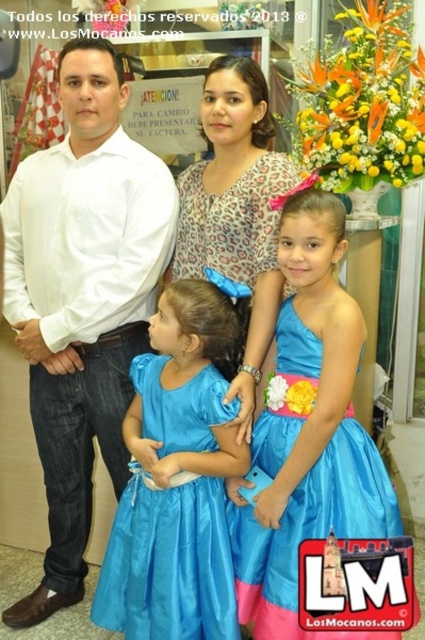
You are a photographer trying to adjust the spacing between the two girls wearing the matte blue dress at center and the blue satin dress at center so that they are exactly 10 inches apart. Currently, how far apart are they?

The matte blue dress at center is 9.13 inches from blue satin dress at center.

Based on the photo, you are a photographer setting up for a family photo. You see the white shirt at left and the matte blue dress at center in your viewfinder. Which clothing item is positioned higher in the frame?

The white shirt at left is located above the matte blue dress at center, so it is positioned higher in the frame.

You are a photographer taking a picture of the family. You notice the matte blue dress at center and the matte leopard print blouse at center. Which one should you focus on to ensure the subject closest to the camera is sharp?

The matte blue dress at center is closer to the viewer than the matte leopard print blouse at center, so focusing on the matte blue dress at center will ensure the closest subject is sharp.